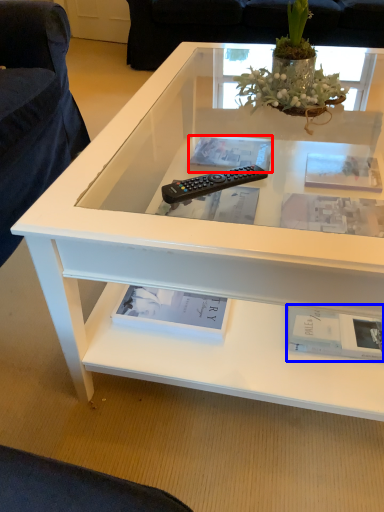
Question: Which object is further to the camera taking this photo, book (highlighted by a red box) or book (highlighted by a blue box)?

Choices:
 (A) book
 (B) book

Answer: (A)